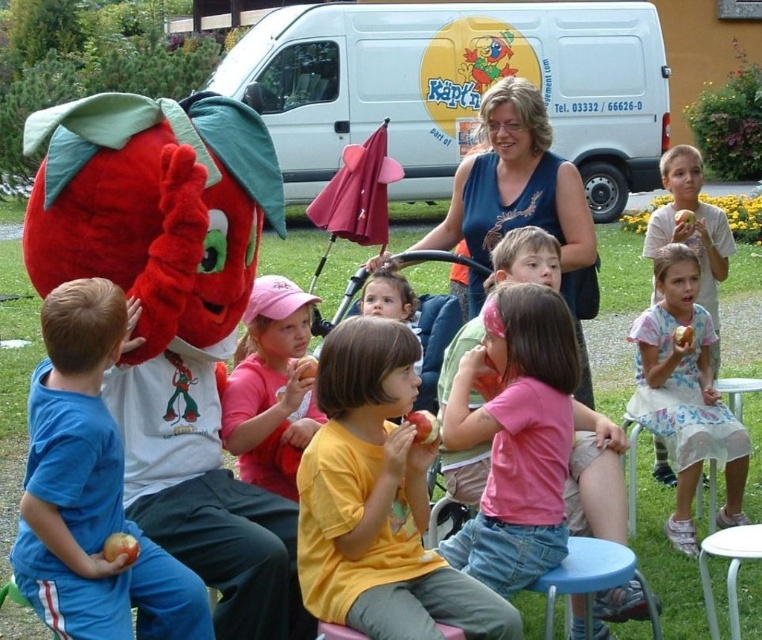
You are a photographer standing 5 feet away from the yellow matte shirt at center and pink fabric cap at center. You want to capture a photo where both subjects are in focus. Given that your camera can focus on objects within a 30 inch range, will both subjects be in focus?

The distance between the yellow matte shirt at center and pink fabric cap at center is 30.70 inches. Since the camera can focus within a 30 inch range, the subjects are slightly beyond the focus range. Therefore, both subjects may not be in focus simultaneously.

You are standing at the position of the child in the yellow matte shirt at center. The dragon costume is 8.53 feet away from you. If you want to give the dragon costume an apple, can you reach it without moving?

The distance between you and the dragon costume is 8.53 feet, which is too far to reach without moving. You need to approach closer to give the dragon costume an apple.

You are a photographer trying to capture a clear photo of the pink fabric cap at center and the blue fabric dress at center. Which object should you focus on first to ensure it appears sharp in the photo?

The blue fabric dress at center is positioned over the pink fabric cap at center, so you should focus on the blue fabric dress at center first to ensure it appears sharp in the photo.